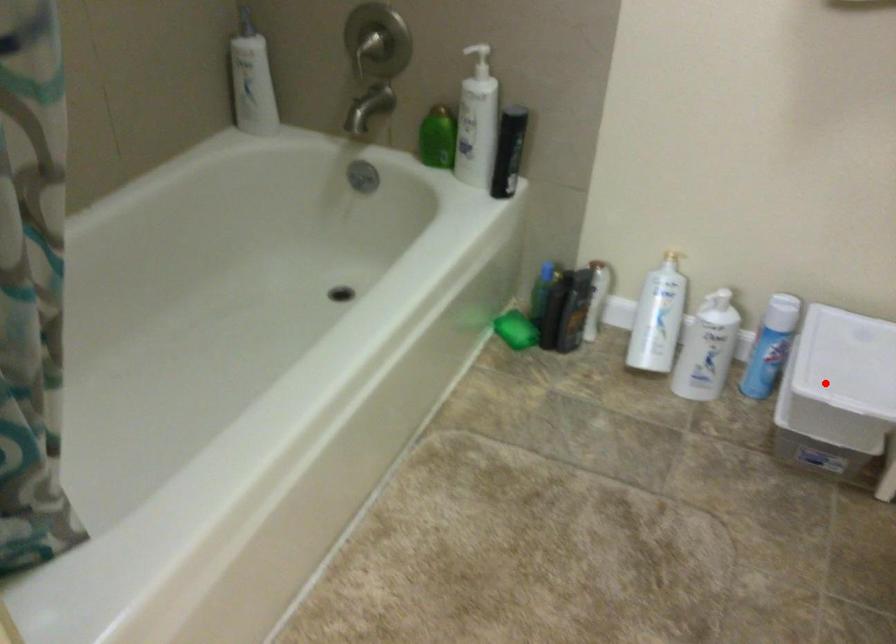
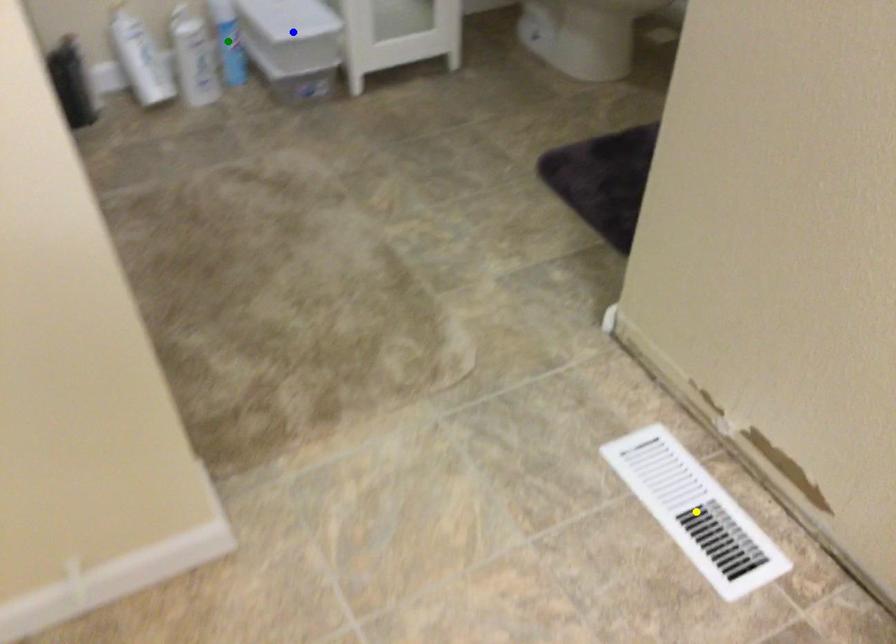
Question: I am providing you with two images of the same scene from different viewpoints. A red point is marked on the first image. You are given multiple points on the second image. In image 2, which mark is for the same physical point as the one in image 1?

Choices:
 (A) yellow point
 (B) blue point
 (C) green point

Answer: (B)